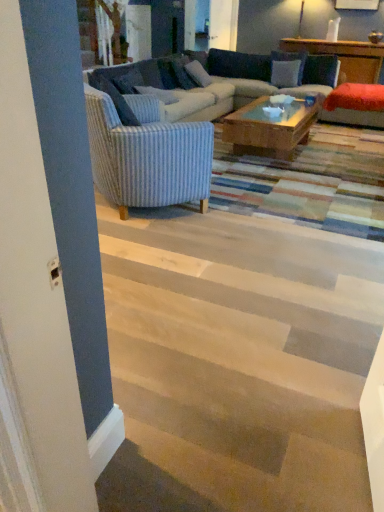
Question: Does blue striped pillow at upper left, marked as the fourth pillow in a right-to-left arrangement, come behind striped fabric couch at center?

Choices:
 (A) no
 (B) yes

Answer: (B)

Question: Is blue striped pillow at upper left, placed as the first pillow when sorted from left to right, thinner than striped fabric couch at center?

Choices:
 (A) yes
 (B) no

Answer: (A)

Question: Does blue striped pillow at upper left, placed as the first pillow when sorted from left to right, have a smaller size compared to striped fabric couch at center?

Choices:
 (A) yes
 (B) no

Answer: (A)

Question: Are blue striped pillow at upper left, placed as the first pillow when sorted from left to right, and striped fabric couch at center beside each other?

Choices:
 (A) no
 (B) yes

Answer: (A)

Question: Is blue striped pillow at upper left, marked as the fourth pillow in a right-to-left arrangement, far from striped fabric couch at center?

Choices:
 (A) yes
 (B) no

Answer: (B)

Question: Considering their positions, is striped fabric couch at center located in front of or behind white fabric pillow at upper center, marked as the third pillow in a left-to-right arrangement?

Choices:
 (A) behind
 (B) front

Answer: (B)

Question: From the image's perspective, is striped fabric couch at center located above or below white fabric pillow at upper center, marked as the third pillow in a left-to-right arrangement?

Choices:
 (A) below
 (B) above

Answer: (A)

Question: In terms of height, does striped fabric couch at center look taller or shorter compared to white fabric pillow at upper center, the 2th pillow viewed from the right?

Choices:
 (A) tall
 (B) short

Answer: (A)

Question: Is striped fabric couch at center wider or thinner than white fabric pillow at upper center, marked as the third pillow in a left-to-right arrangement?

Choices:
 (A) thin
 (B) wide

Answer: (B)

Question: Based on their positions, is wooden stairs at lower center located to the left or right of blue striped pillow at upper left, placed as the first pillow when sorted from left to right?

Choices:
 (A) right
 (B) left

Answer: (A)

Question: Is wooden stairs at lower center bigger or smaller than blue striped pillow at upper left, marked as the fourth pillow in a right-to-left arrangement?

Choices:
 (A) small
 (B) big

Answer: (B)

Question: Considering the positions of point (357, 464) and point (135, 79), is point (357, 464) closer or farther from the camera than point (135, 79)?

Choices:
 (A) farther
 (B) closer

Answer: (B)

Question: In terms of height, does wooden stairs at lower center look taller or shorter compared to blue striped pillow at upper left, placed as the first pillow when sorted from left to right?

Choices:
 (A) tall
 (B) short

Answer: (B)

Question: From the image's perspective, is blue striped pillow at upper left, placed as the first pillow when sorted from left to right, located above or below blue striped pillow at center, the 2th pillow in the left-to-right sequence?

Choices:
 (A) above
 (B) below

Answer: (A)

Question: From their relative heights in the image, would you say blue striped pillow at upper left, placed as the first pillow when sorted from left to right, is taller or shorter than blue striped pillow at center, which is the third pillow from right to left?

Choices:
 (A) tall
 (B) short

Answer: (A)